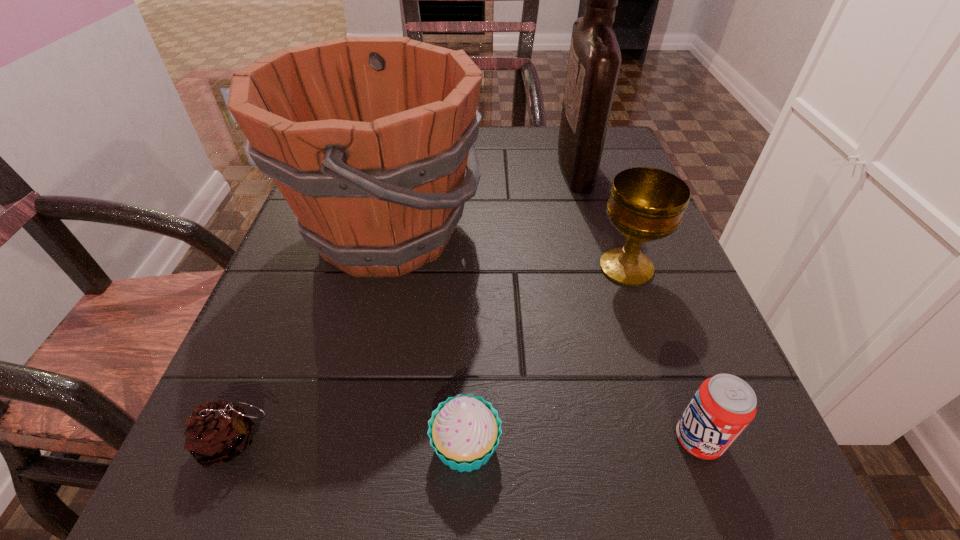
You are a GUI agent. You are given a task and a screenshot of the screen. Output one action in this format:
    pyautogui.click(x=<x>, y=<y>)
    Task: Click on the vacant space at the right edge of the desktop
    
    Given the screenshot: What is the action you would take?
    pyautogui.click(x=638, y=310)

This screenshot has width=960, height=540. In the image, there is a desktop. In order to click on vacant space at the near left corner in this screenshot , I will do pyautogui.click(x=188, y=467).

Identify the location of free space at the far right corner. (612, 152).

This screenshot has width=960, height=540. What are the coordinates of `vacant space at the near right corner` in the screenshot? It's located at (776, 506).

What are the coordinates of `free space that is in between the liquor and the second tallest object` in the screenshot? It's located at (481, 199).

At what (x,y) coordinates should I click in order to perform the action: click on empty location between the shortest object and the chalice. Please return your answer as a coordinate pair (x, y). Looking at the image, I should click on (430, 355).

Identify the location of empty location between the liquor and the pinecone. (404, 304).

You are a GUI agent. You are given a task and a screenshot of the screen. Output one action in this format:
    pyautogui.click(x=<x>, y=<y>)
    Task: Click on the free space between the third tallest object and the pinecone
    This screenshot has width=960, height=540.
    Given the screenshot: What is the action you would take?
    pyautogui.click(x=430, y=355)

Where is `empty space that is in between the soda can and the cupcake`? empty space that is in between the soda can and the cupcake is located at coordinates (582, 442).

At what (x,y) coordinates should I click in order to perform the action: click on free space between the fourth shortest object and the cupcake. Please return your answer as a coordinate pair (x, y). This screenshot has height=540, width=960. Looking at the image, I should click on coord(546,356).